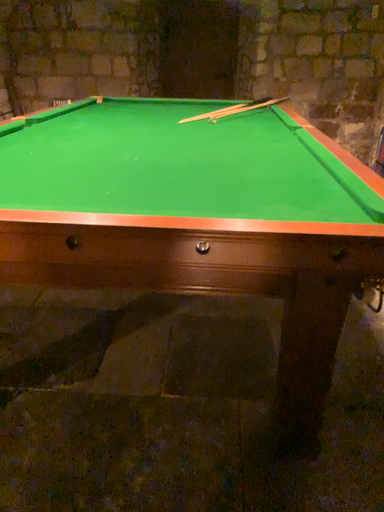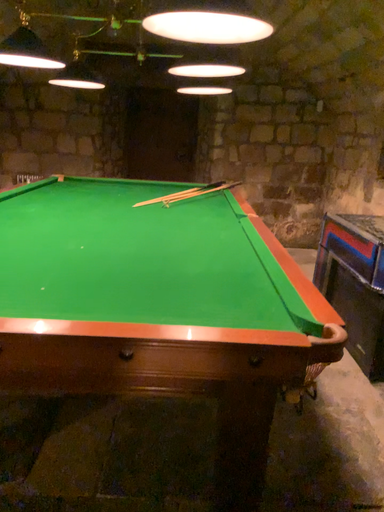
Question: How did the camera likely rotate when shooting the video?

Choices:
 (A) rotated downward
 (B) rotated upward

Answer: (B)